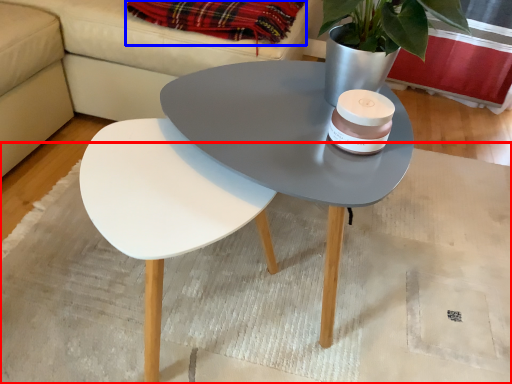
Question: Which object appears closest to the camera in this image, mat (highlighted by a red box) or blanket (highlighted by a blue box)?

Choices:
 (A) mat
 (B) blanket

Answer: (A)